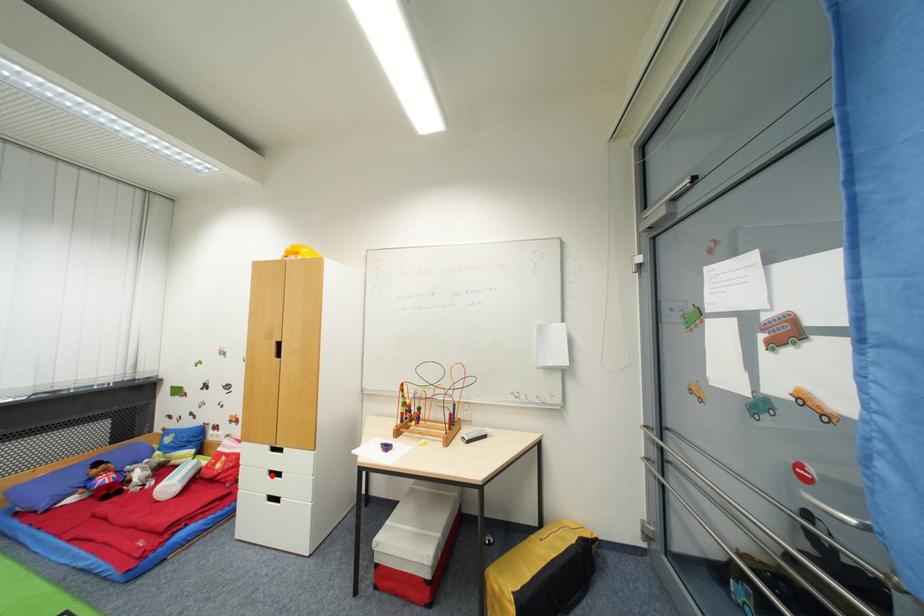
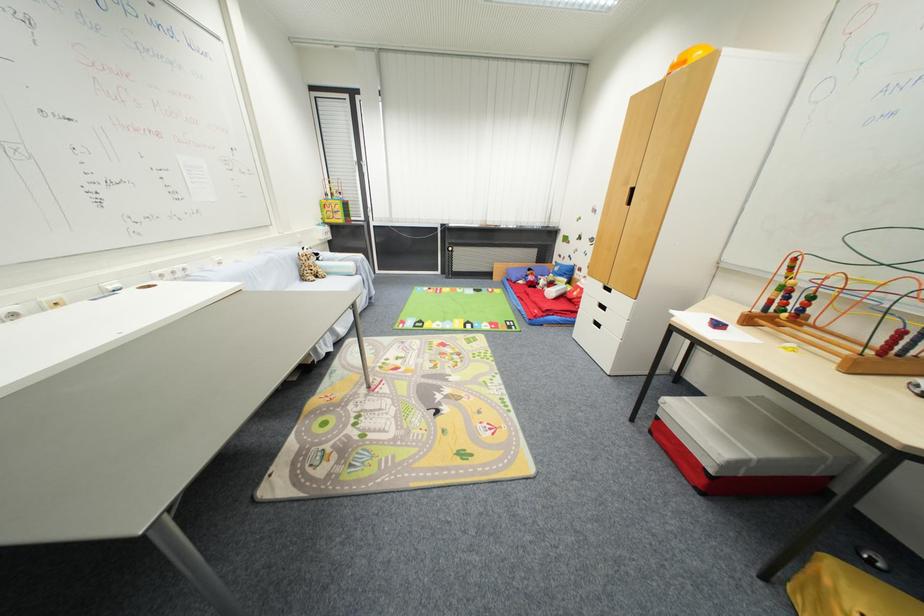
Find the pixel in the second image that matches the highlighted location in the first image.

(602, 306)